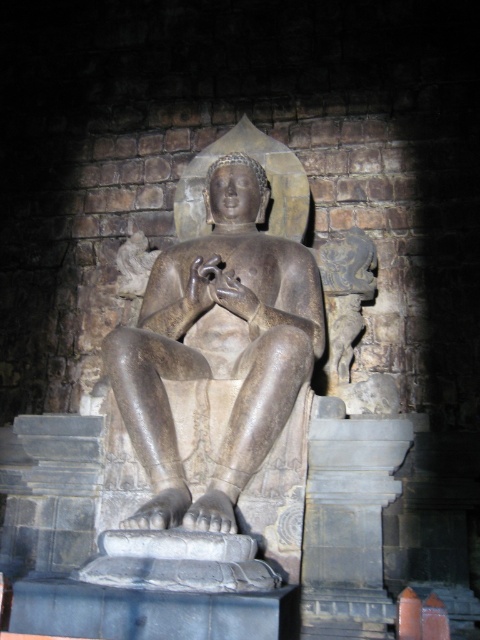
Question: Is the position of polished stone statue at center less distant than that of gray stone pedestal at center?

Choices:
 (A) no
 (B) yes

Answer: (B)

Question: Can you confirm if polished stone statue at center is bigger than gray stone pedestal at center?

Choices:
 (A) no
 (B) yes

Answer: (B)

Question: Which of the following is the farthest from the observer?

Choices:
 (A) gray stone pedestal at center
 (B) polished stone statue at center

Answer: (A)

Question: Which point appears closest to the camera in this image?

Choices:
 (A) (290, 356)
 (B) (324, 579)

Answer: (B)

Question: Where is polished stone statue at center located in relation to gray stone pedestal at center in the image?

Choices:
 (A) above
 (B) below

Answer: (A)